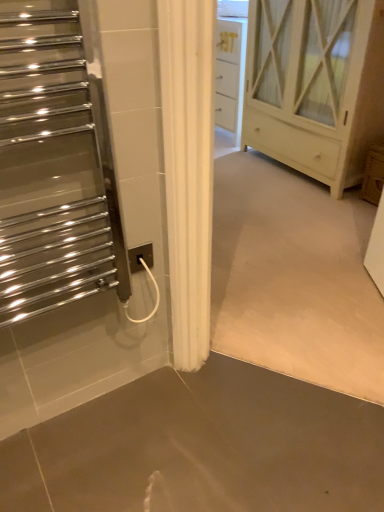
Measure the distance between smooth concrete floor at lower center and camera.

1.06 meters.

The height and width of the screenshot is (512, 384). I want to click on white wood cabinet at center, so click(x=315, y=85).

Locate an element on the screen. The height and width of the screenshot is (512, 384). polished chrome towel warmer at left is located at coordinates (55, 162).

Where is `white plastic electric outlet at center`? white plastic electric outlet at center is located at coordinates (140, 257).

I want to click on electric outlet in front of the white wood cabinet at center, so point(140,257).

Consider the image. Considering the sizes of white wood cabinet at center and white plastic electric outlet at center in the image, is white wood cabinet at center wider or thinner than white plastic electric outlet at center?

white wood cabinet at center is wider than white plastic electric outlet at center.

Is white wood cabinet at center closer to the viewer compared to white plastic electric outlet at center?

No, white wood cabinet at center is further to the viewer.

Are white wood cabinet at center and white plastic electric outlet at center beside each other?

No, white wood cabinet at center is not making contact with white plastic electric outlet at center.

Considering their positions, is white wood cabinet at center located in front of or behind smooth concrete floor at lower center?

In the image, white wood cabinet at center appears behind smooth concrete floor at lower center.

Identify the location of concrete below the white wood cabinet at center (from a real-world perspective). The width and height of the screenshot is (384, 512). (201, 447).

Is white wood cabinet at center positioned beyond the bounds of smooth concrete floor at lower center?

Yes, white wood cabinet at center is outside of smooth concrete floor at lower center.

From the image's perspective, which object appears higher, white plastic electric outlet at center or white wood cabinet at center?

white wood cabinet at center.

Which object is further away from the camera, white plastic electric outlet at center or white wood cabinet at center?

white wood cabinet at center is further from the camera.

From a real-world perspective, is white plastic electric outlet at center on top of white wood cabinet at center?

No, from a real-world perspective, white plastic electric outlet at center is not on top of white wood cabinet at center.

Looking at this image, considering the positions of objects white plastic electric outlet at center and white wood cabinet at center in the image provided, who is more to the left, white plastic electric outlet at center or white wood cabinet at center?

From the viewer's perspective, white plastic electric outlet at center appears more on the left side.

Considering the relative sizes of white plastic electric outlet at center and polished chrome towel warmer at left in the image provided, is white plastic electric outlet at center smaller than polished chrome towel warmer at left?

Yes.

From the picture: Would you consider white plastic electric outlet at center to be distant from polished chrome towel warmer at left?

white plastic electric outlet at center is actually quite close to polished chrome towel warmer at left.

From a real-world perspective, between white plastic electric outlet at center and polished chrome towel warmer at left, who is vertically higher?

polished chrome towel warmer at left.

Based on the photo, from the image's perspective, is white plastic electric outlet at center located beneath polished chrome towel warmer at left?

Yes, from the image's perspective, white plastic electric outlet at center is beneath polished chrome towel warmer at left.

Is smooth concrete floor at lower center oriented towards white wood cabinet at center?

No, smooth concrete floor at lower center is not turned towards white wood cabinet at center.

From the image's perspective, is smooth concrete floor at lower center positioned above or below white wood cabinet at center?

smooth concrete floor at lower center is situated lower than white wood cabinet at center in the image.

Considering the sizes of objects smooth concrete floor at lower center and white wood cabinet at center in the image provided, who is thinner, smooth concrete floor at lower center or white wood cabinet at center?

Thinner between the two is white wood cabinet at center.

At what (x,y) coordinates should I click in order to perform the action: click on concrete that appears on the left of white wood cabinet at center. Please return your answer as a coordinate pair (x, y). The image size is (384, 512). Looking at the image, I should click on (201, 447).

Consider the image. Is white wood cabinet at center directly adjacent to polished chrome towel warmer at left?

There is a gap between white wood cabinet at center and polished chrome towel warmer at left.

What's the angular difference between white wood cabinet at center and polished chrome towel warmer at left's facing directions?

There is a 90.3-degree angle between the facing directions of white wood cabinet at center and polished chrome towel warmer at left.

Is white wood cabinet at center oriented away from polished chrome towel warmer at left?

No.

Between white wood cabinet at center and polished chrome towel warmer at left, which one is positioned in front?

polished chrome towel warmer at left is in front.

Is smooth concrete floor at lower center far from white plastic electric outlet at center?

No, smooth concrete floor at lower center is not far from white plastic electric outlet at center.

Is point (361, 470) less distant than point (132, 264)?

Yes, it is.

How many degrees apart are the facing directions of smooth concrete floor at lower center and white plastic electric outlet at center?

90 degrees.

From a real-world perspective, between smooth concrete floor at lower center and white plastic electric outlet at center, who is vertically lower?

In real-world perspective, smooth concrete floor at lower center is lower.

At what (x,y) coordinates should I click in order to perform the action: click on electric outlet in front of the white wood cabinet at center. Please return your answer as a coordinate pair (x, y). Image resolution: width=384 pixels, height=512 pixels. Looking at the image, I should click on (140, 257).

The image size is (384, 512). What are the coordinates of `the chest of drawers behind the smooth concrete floor at lower center` in the screenshot? It's located at (315, 85).

Which object lies nearer to the anchor point polished chrome towel warmer at left, smooth concrete floor at lower center or white plastic electric outlet at center?

white plastic electric outlet at center is positioned closer to the anchor polished chrome towel warmer at left.

When comparing their distances from white plastic electric outlet at center, does white wood cabinet at center or smooth concrete floor at lower center seem further?

Based on the image, white wood cabinet at center appears to be further to white plastic electric outlet at center.

Considering their positions, is smooth concrete floor at lower center positioned further to white plastic electric outlet at center than white wood cabinet at center?

white wood cabinet at center lies further to white plastic electric outlet at center than the other object.

When comparing their distances from white plastic electric outlet at center, does white wood cabinet at center or polished chrome towel warmer at left seem closer?

polished chrome towel warmer at left is positioned closer to the anchor white plastic electric outlet at center.

Which object lies further to the anchor point smooth concrete floor at lower center, polished chrome towel warmer at left or white plastic electric outlet at center?

The object further to smooth concrete floor at lower center is polished chrome towel warmer at left.

Based on their spatial positions, is polished chrome towel warmer at left or white plastic electric outlet at center closer to white wood cabinet at center?

Based on the image, white plastic electric outlet at center appears to be nearer to white wood cabinet at center.

Based on their spatial positions, is white plastic electric outlet at center or white wood cabinet at center closer to polished chrome towel warmer at left?

The object closer to polished chrome towel warmer at left is white plastic electric outlet at center.

Estimate the real-world distances between objects in this image. Which object is further from smooth concrete floor at lower center, white plastic electric outlet at center or polished chrome towel warmer at left?

polished chrome towel warmer at left lies further to smooth concrete floor at lower center than the other object.

At what (x,y) coordinates should I click in order to perform the action: click on electric outlet located between polished chrome towel warmer at left and white wood cabinet at center in the depth direction. Please return your answer as a coordinate pair (x, y). The width and height of the screenshot is (384, 512). Looking at the image, I should click on (140, 257).

Image resolution: width=384 pixels, height=512 pixels. What are the coordinates of `escalator that lies between white wood cabinet at center and smooth concrete floor at lower center from top to bottom` in the screenshot? It's located at (55, 162).

Find the location of `electric outlet between polished chrome towel warmer at left and smooth concrete floor at lower center in the up-down direction`. electric outlet between polished chrome towel warmer at left and smooth concrete floor at lower center in the up-down direction is located at coordinates (140, 257).

This screenshot has width=384, height=512. Identify the location of electric outlet between white wood cabinet at center and smooth concrete floor at lower center in the up-down direction. (140, 257).